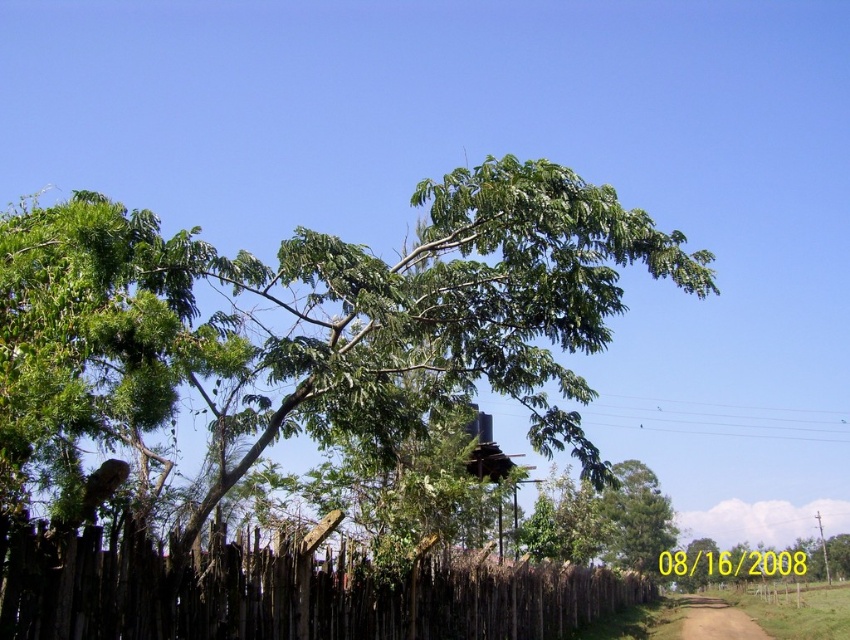
Question: In this image, where is green leafy tree at center located relative to brown dirt track at lower center?

Choices:
 (A) below
 (B) above

Answer: (B)

Question: Can you confirm if green leafy tree at center is positioned below brown wooden fence at lower left?

Choices:
 (A) yes
 (B) no

Answer: (B)

Question: Which object is farther from the camera taking this photo?

Choices:
 (A) brown dirt track at lower center
 (B) brown wooden fence at lower left

Answer: (A)

Question: Estimate the real-world distances between objects in this image. Which object is farther from the green leafy tree at center?

Choices:
 (A) brown dirt track at lower center
 (B) brown wooden fence at lower left

Answer: (A)

Question: Which point is farther to the camera?

Choices:
 (A) brown dirt track at lower center
 (B) brown wooden fence at lower left
 (C) green leafy tree at center

Answer: (A)

Question: Does brown wooden fence at lower left lie in front of brown dirt track at lower center?

Choices:
 (A) no
 (B) yes

Answer: (B)